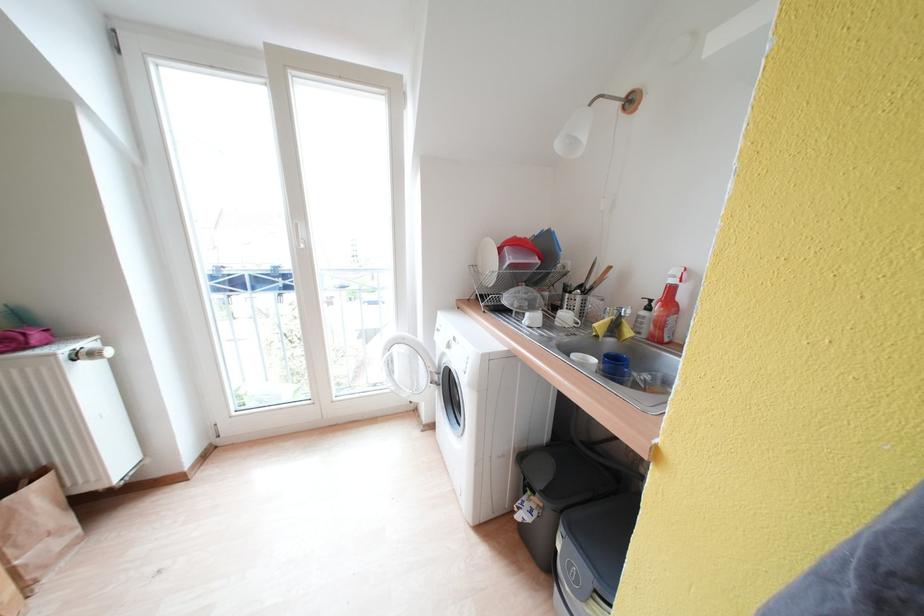
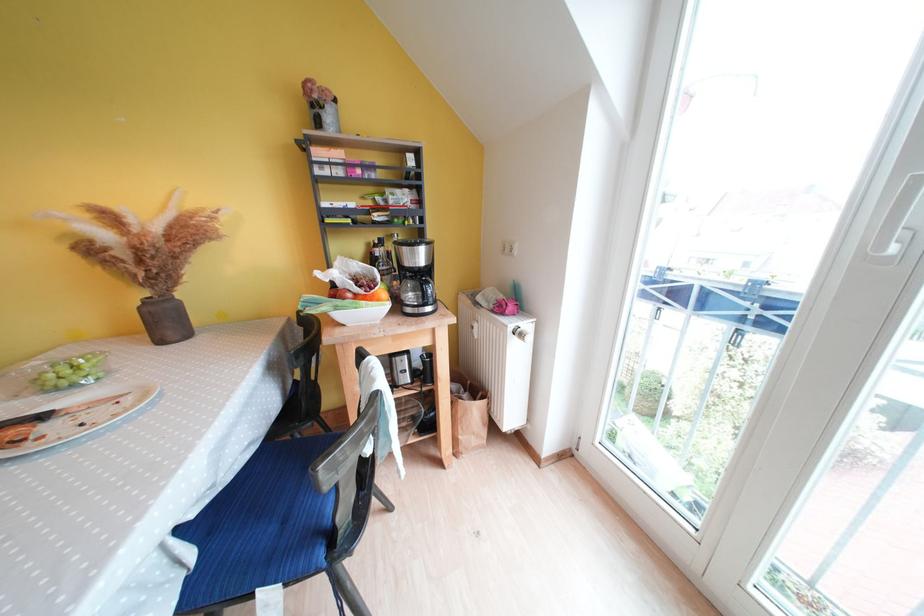
First-person continuous shooting, in which direction is the camera rotating?

The camera rotated toward left-down.